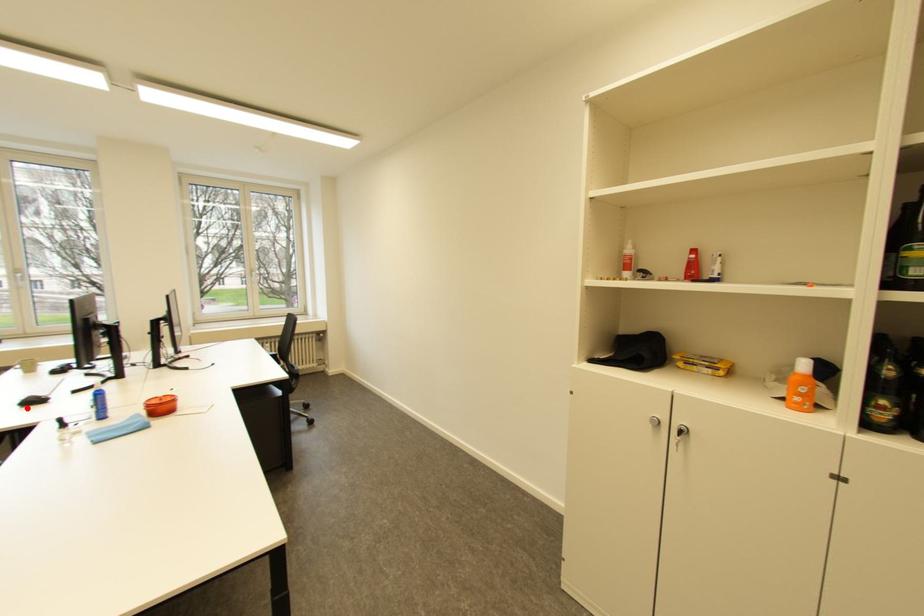
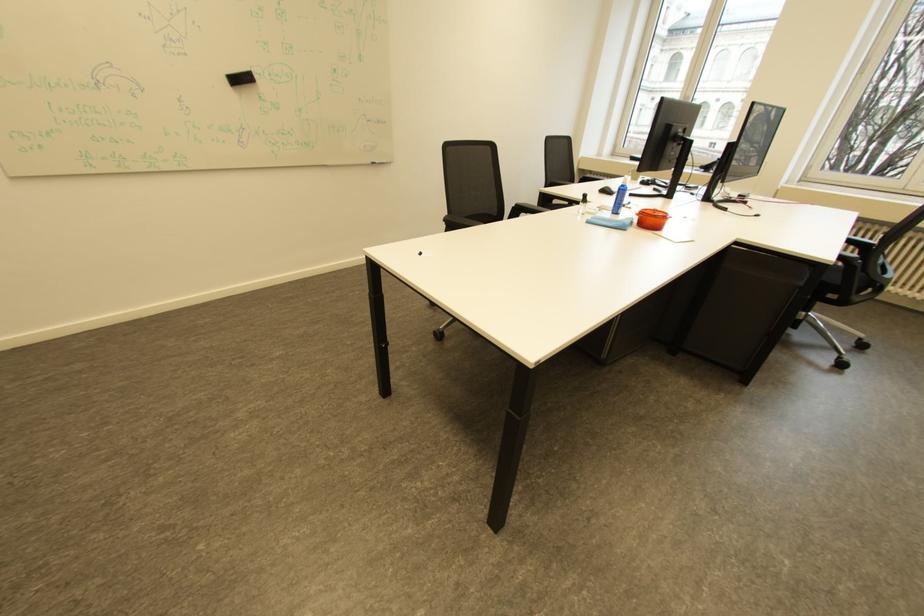
Locate, in the second image, the point that corresponds to the highlighted location in the first image.

(608, 193)